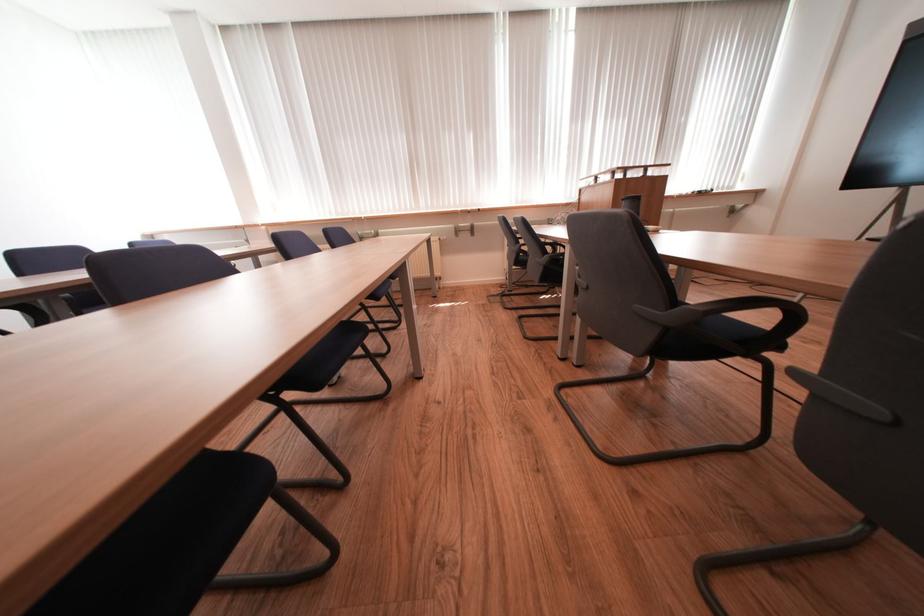
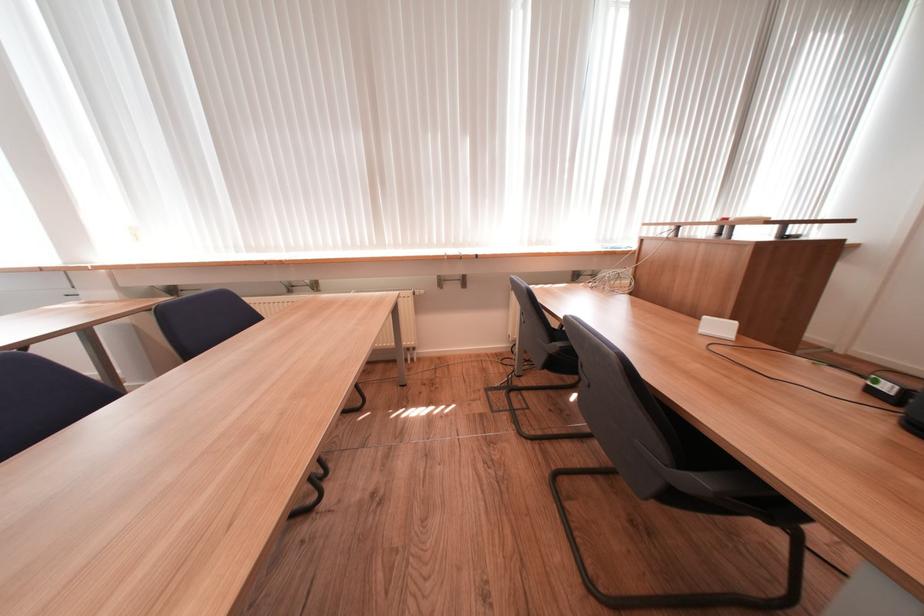
Question: In a continuous first-person perspective shot, in which direction is the camera moving?

Choices:
 (A) Left
 (B) Right
 (C) Forward
 (D) Backward

Answer: (C)